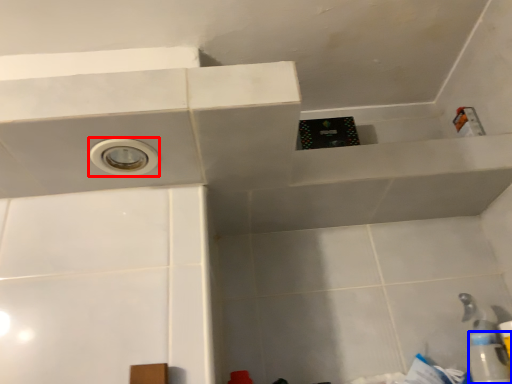
Question: Which object is further to the camera taking this photo, hole (highlighted by a red box) or bottle (highlighted by a blue box)?

Choices:
 (A) hole
 (B) bottle

Answer: (B)